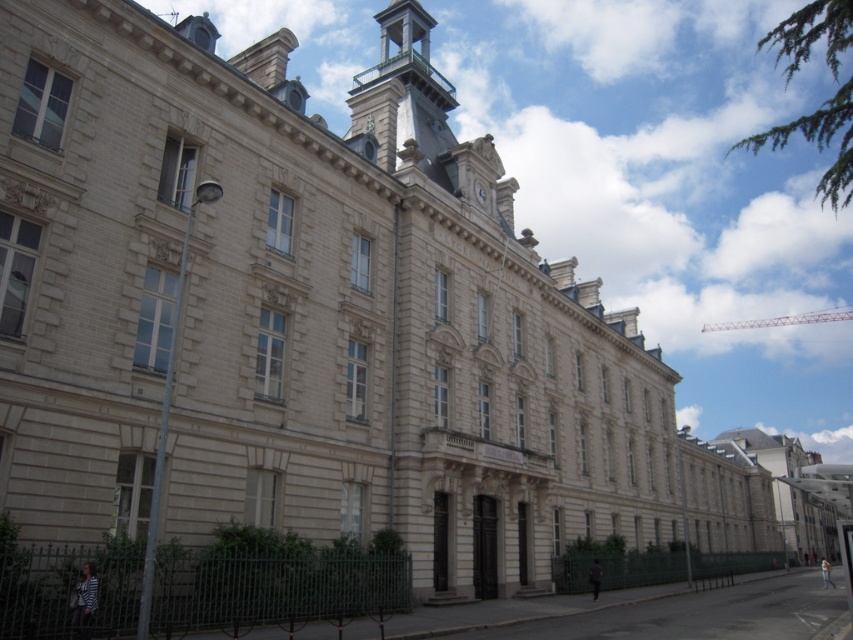
Question: Is polished brass bell tower at upper center to the right of white stone clock at upper center from the viewer's perspective?

Choices:
 (A) no
 (B) yes

Answer: (A)

Question: Among these points, which one is nearest to the camera?

Choices:
 (A) (396, 116)
 (B) (479, 188)

Answer: (A)

Question: Which point appears farthest from the camera in this image?

Choices:
 (A) (480, 198)
 (B) (409, 132)

Answer: (B)

Question: Is polished brass bell tower at upper center wider than white stone clock at upper center?

Choices:
 (A) no
 (B) yes

Answer: (B)

Question: Is polished brass bell tower at upper center smaller than white stone clock at upper center?

Choices:
 (A) yes
 (B) no

Answer: (B)